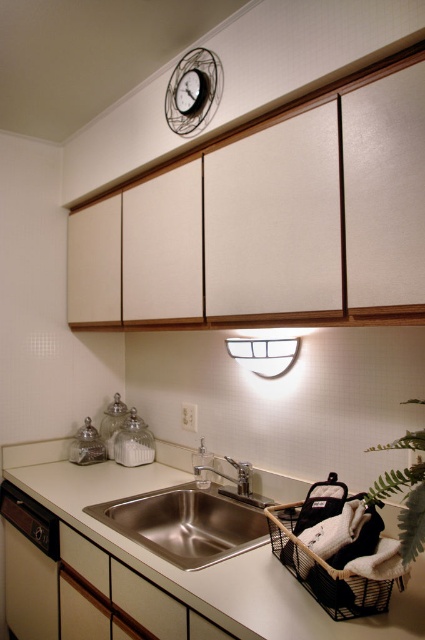
Where is `green leafy plant at lower right`? green leafy plant at lower right is located at coordinates (405, 493).

Is green leafy plant at lower right above white plastic exhaust hood at center?

No, green leafy plant at lower right is not above white plastic exhaust hood at center.

Who is more forward, (422,499) or (229,342)?

Point (422,499)

Locate an element on the screen. This screenshot has height=640, width=425. green leafy plant at lower right is located at coordinates (405, 493).

Is white matte countertop at center positioned behind stainless steel sink at center?

No.

Who is positioned more to the left, white matte countertop at center or stainless steel sink at center?

Positioned to the left is white matte countertop at center.

Is point (184, 596) less distant than point (229, 516)?

Yes.

Locate an element on the screen. Image resolution: width=425 pixels, height=640 pixels. white matte countertop at center is located at coordinates (173, 564).

Can you confirm if white matte countertop at center is thinner than silver metallic faucet at center?

In fact, white matte countertop at center might be wider than silver metallic faucet at center.

Between point (34, 490) and point (241, 484), which one is positioned behind?

The point (34, 490) is more distant.

Between point (150, 481) and point (243, 486), which one is positioned in front?

Point (243, 486) is in front.

Locate an element on the screen. The image size is (425, 640). white matte countertop at center is located at coordinates (173, 564).